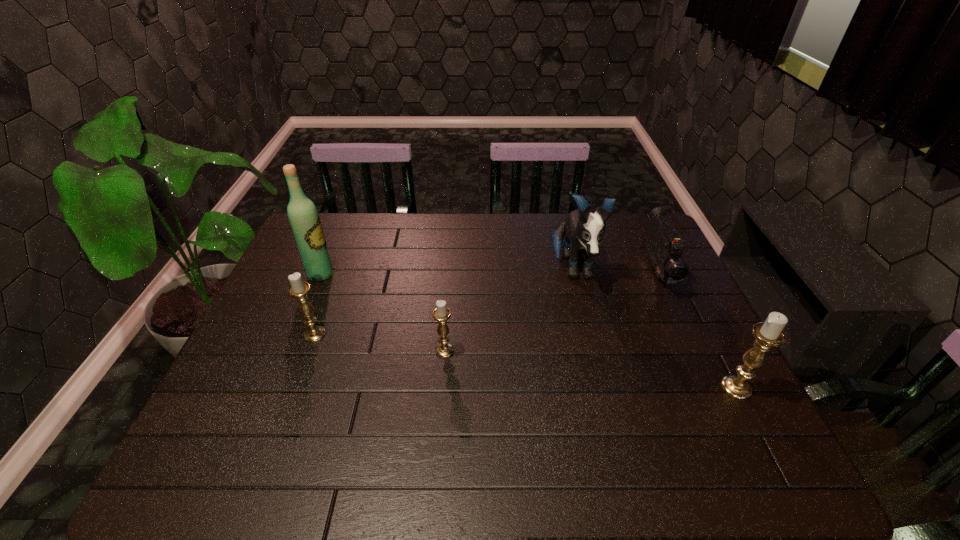
Where is `the fourth tallest object`? This screenshot has height=540, width=960. the fourth tallest object is located at coordinates (298, 289).

Locate an element on the screen. the leftmost candle holder is located at coordinates (298, 289).

The height and width of the screenshot is (540, 960). Identify the location of the second farthest candle holder. (441, 313).

Identify the location of the second candle holder from left to right. This screenshot has width=960, height=540. (441, 313).

This screenshot has width=960, height=540. In order to click on the rightmost candle holder in this screenshot , I will do `click(768, 334)`.

Locate an element on the screen. The width and height of the screenshot is (960, 540). the nearest candle holder is located at coordinates (768, 334).

Where is `wine bottle`? The width and height of the screenshot is (960, 540). wine bottle is located at coordinates (304, 219).

Find the location of `camcorder`. camcorder is located at coordinates (664, 245).

What are the coordinates of `the third object from right to left` in the screenshot? It's located at (583, 231).

The image size is (960, 540). Find the location of `the second tallest object`. the second tallest object is located at coordinates (583, 231).